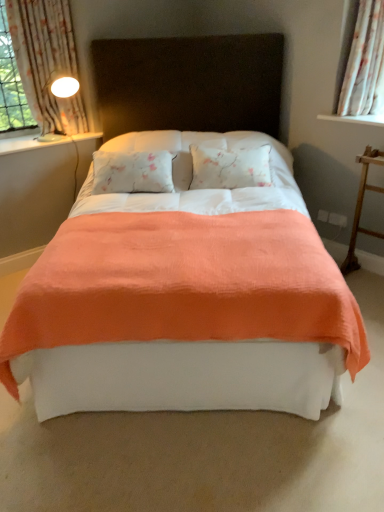
Question: Can you confirm if floral fabric curtain at left, which is counted as the second curtain, starting from the right, is bigger than wooden ladder at right?

Choices:
 (A) no
 (B) yes

Answer: (A)

Question: Does floral fabric curtain at left, which is counted as the second curtain, starting from the right, turn towards wooden ladder at right?

Choices:
 (A) yes
 (B) no

Answer: (B)

Question: Does floral fabric curtain at left, which is counted as the first curtain, starting from the left, have a greater height compared to wooden ladder at right?

Choices:
 (A) no
 (B) yes

Answer: (B)

Question: Is floral fabric curtain at left, which is counted as the second curtain, starting from the right, shorter than wooden ladder at right?

Choices:
 (A) yes
 (B) no

Answer: (B)

Question: From a real-world perspective, is floral fabric curtain at left, which is counted as the second curtain, starting from the right, located beneath wooden ladder at right?

Choices:
 (A) yes
 (B) no

Answer: (B)

Question: Considering the positions of floral fabric curtain at left, which is counted as the second curtain, starting from the right, and white glossy lamp at upper left in the image, is floral fabric curtain at left, which is counted as the second curtain, starting from the right, bigger or smaller than white glossy lamp at upper left?

Choices:
 (A) big
 (B) small

Answer: (A)

Question: Considering the positions of floral fabric curtain at left, which is counted as the first curtain, starting from the left, and white glossy lamp at upper left in the image, is floral fabric curtain at left, which is counted as the first curtain, starting from the left, wider or thinner than white glossy lamp at upper left?

Choices:
 (A) wide
 (B) thin

Answer: (B)

Question: In terms of height, does floral fabric curtain at left, which is counted as the second curtain, starting from the right, look taller or shorter compared to white glossy lamp at upper left?

Choices:
 (A) tall
 (B) short

Answer: (A)

Question: Considering their positions, is floral fabric curtain at left, which is counted as the first curtain, starting from the left, located in front of or behind white glossy lamp at upper left?

Choices:
 (A) behind
 (B) front

Answer: (B)

Question: Is point (44, 56) positioned closer to the camera than point (36, 145)?

Choices:
 (A) farther
 (B) closer

Answer: (B)

Question: Considering the positions of floral fabric curtain at left, which is counted as the second curtain, starting from the right, and white glossy window sill at left in the image, is floral fabric curtain at left, which is counted as the second curtain, starting from the right, bigger or smaller than white glossy window sill at left?

Choices:
 (A) small
 (B) big

Answer: (B)

Question: From their relative heights in the image, would you say floral fabric curtain at left, which is counted as the first curtain, starting from the left, is taller or shorter than white glossy window sill at left?

Choices:
 (A) short
 (B) tall

Answer: (B)

Question: Which is correct: floral fabric curtain at left, which is counted as the first curtain, starting from the left, is inside white glossy window sill at left, or outside of it?

Choices:
 (A) inside
 (B) outside

Answer: (B)

Question: From the image's perspective, is white floral fabric curtain at upper right, which is the first curtain in right-to-left order, positioned above or below white glossy lamp at upper left?

Choices:
 (A) above
 (B) below

Answer: (A)

Question: Is white floral fabric curtain at upper right, which is the first curtain in right-to-left order, wider or thinner than white glossy lamp at upper left?

Choices:
 (A) wide
 (B) thin

Answer: (B)